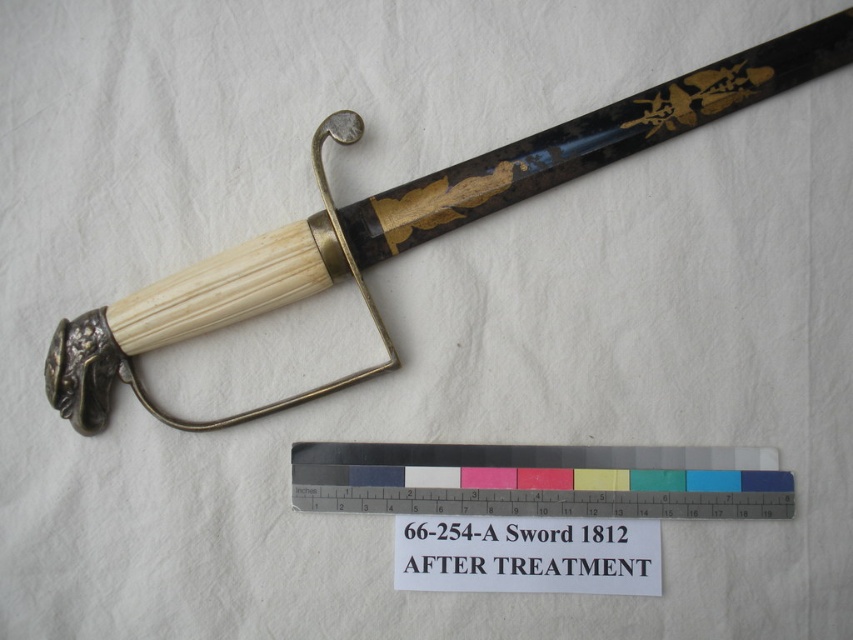
You are an art appraiser examining the image. You need to determine the distance between the matte black sword at upper center and the metallic ruler at center. Can you use the ruler in the image to measure this distance?

The matte black sword at upper center is closer to the viewer than the metallic ruler at center, so the ruler cannot be used to measure the distance between them because it is positioned behind the sword.

You are an art conservator examining the placement of the matte black sword at upper center in the image. Based on its coordinates, can you determine whether it is positioned closer to the top or bottom edge of the image?

The coordinates of the matte black sword at upper center are at point (402,225). Since the y coordinate is 0.472, which is closer to 0.5, the center point of the image, it is positioned closer to the bottom edge than the top edge.